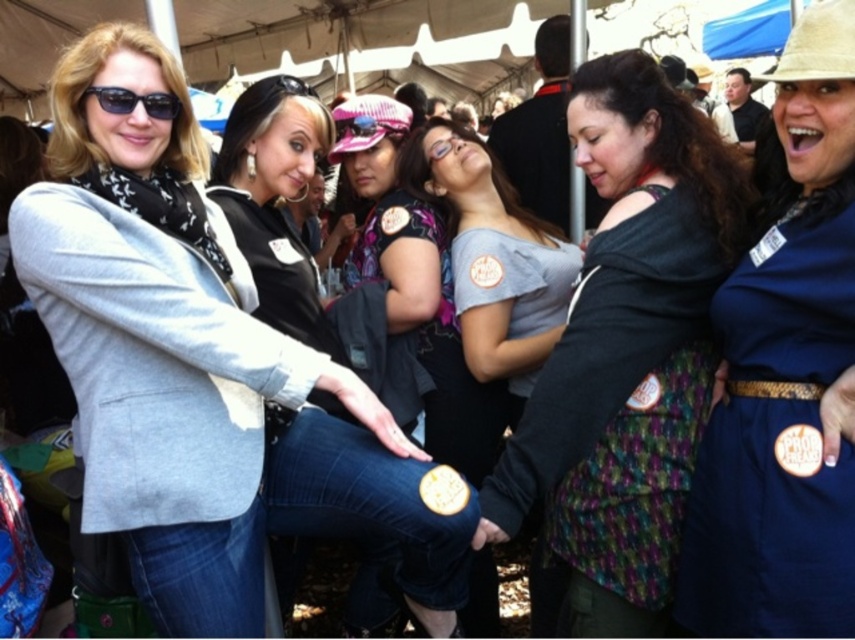
From the picture: Does matte gray blazer at left have a greater width compared to blue fabric dress at center?

Indeed, matte gray blazer at left has a greater width compared to blue fabric dress at center.

Measure the distance between matte gray blazer at left and camera.

matte gray blazer at left and camera are 1.46 meters apart from each other.

Between point (220, 426) and point (818, 419), which one is positioned in front?

Point (818, 419) is in front.

At what (x,y) coordinates should I click in order to perform the action: click on matte gray blazer at left. Please return your answer as a coordinate pair (x, y). This screenshot has height=640, width=855. Looking at the image, I should click on (174, 349).

Can you confirm if matte gray blazer at left is shorter than multicolored fabric vest at center?

Correct, matte gray blazer at left is not as tall as multicolored fabric vest at center.

Which is in front, point (164, 186) or point (657, 140)?

Point (164, 186) is more forward.

You are a GUI agent. You are given a task and a screenshot of the screen. Output one action in this format:
    pyautogui.click(x=<x>, y=<y>)
    Task: Click on the matte gray blazer at left
    Image resolution: width=855 pixels, height=640 pixels.
    Given the screenshot: What is the action you would take?
    pyautogui.click(x=174, y=349)

You are a GUI agent. You are given a task and a screenshot of the screen. Output one action in this format:
    pyautogui.click(x=<x>, y=<y>)
    Task: Click on the matte gray blazer at left
    The width and height of the screenshot is (855, 640).
    Given the screenshot: What is the action you would take?
    pyautogui.click(x=174, y=349)

Does blue fabric dress at center appear on the right side of gray cotton shirt at center?

Indeed, blue fabric dress at center is positioned on the right side of gray cotton shirt at center.

Can you confirm if blue fabric dress at center is positioned below gray cotton shirt at center?

Yes, blue fabric dress at center is below gray cotton shirt at center.

Measure the distance between point (830, 376) and camera.

Point (830, 376) is 1.70 meters away from camera.

Identify the location of blue fabric dress at center. Image resolution: width=855 pixels, height=640 pixels. (783, 374).